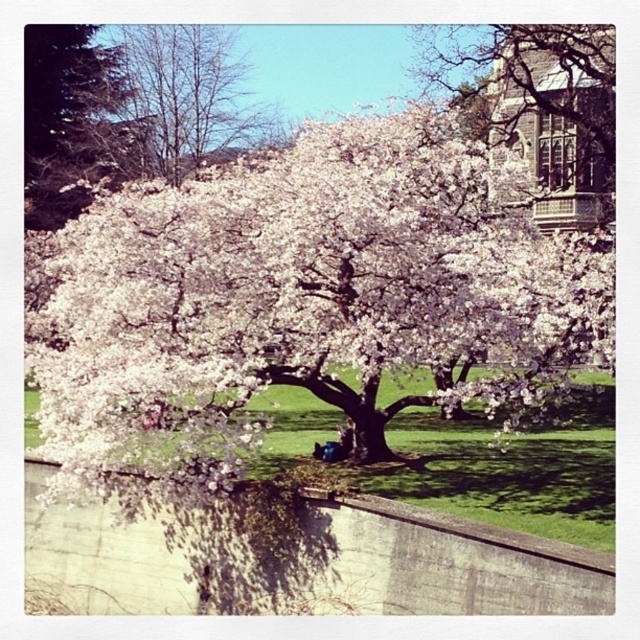
Question: Which point is farther to the camera?

Choices:
 (A) white blossoms at center
 (B) bare branches at upper left

Answer: (B)

Question: Can you confirm if white blossoms at center is thinner than bare branches at upper left?

Choices:
 (A) yes
 (B) no

Answer: (B)

Question: Which point is farther from the camera taking this photo?

Choices:
 (A) (225, 113)
 (B) (88, 310)

Answer: (A)

Question: Is white blossoms at center smaller than bare branches at upper left?

Choices:
 (A) no
 (B) yes

Answer: (A)

Question: Does white blossoms at center have a smaller size compared to bare branches at upper left?

Choices:
 (A) yes
 (B) no

Answer: (B)